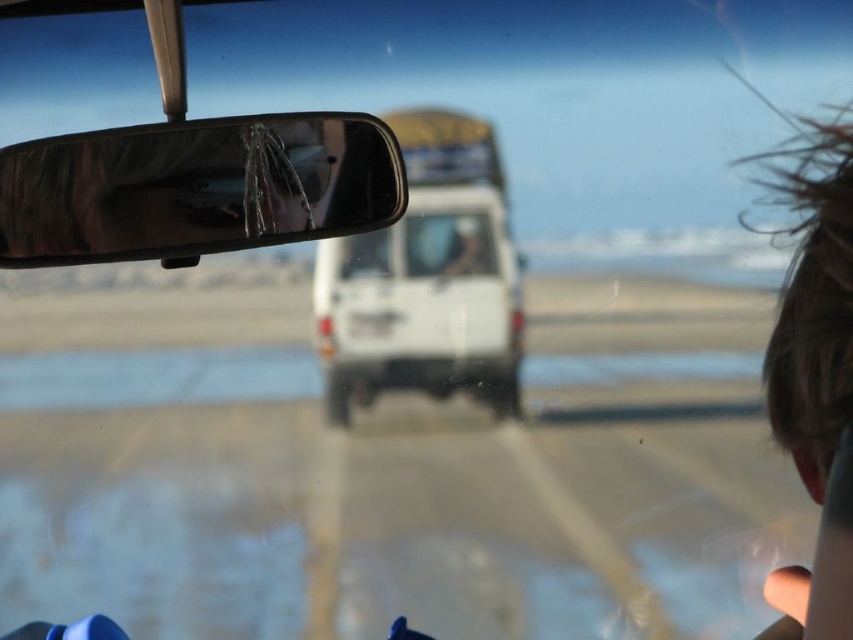
You are sitting in the front passenger seat of a car and looking out the windshield. There is a point at coordinates (334, 140) in your field of view. If you want to touch this point with a 12 inch long stick, can you reach it?

The distance of point (334, 140) from the camera is 20.54 inches. Since the stick is only 12 inches long, you cannot reach the point with the stick.

You are a passenger in the car and want to check the shiny chrome mirror at upper center and the white matte van at center. Which object is positioned more to the left from your viewpoint?

The shiny chrome mirror at upper center is positioned to the left of the white matte van at center, so it is more to the left.

You are a passenger in the vehicle and want to know how far the point at coordinates (439, 256) is from you. Can you determine the distance?

The point at coordinates (439, 256) is 21.77 inches from the camera, so it is approximately 21.77 inches away from you as a passenger in the vehicle.